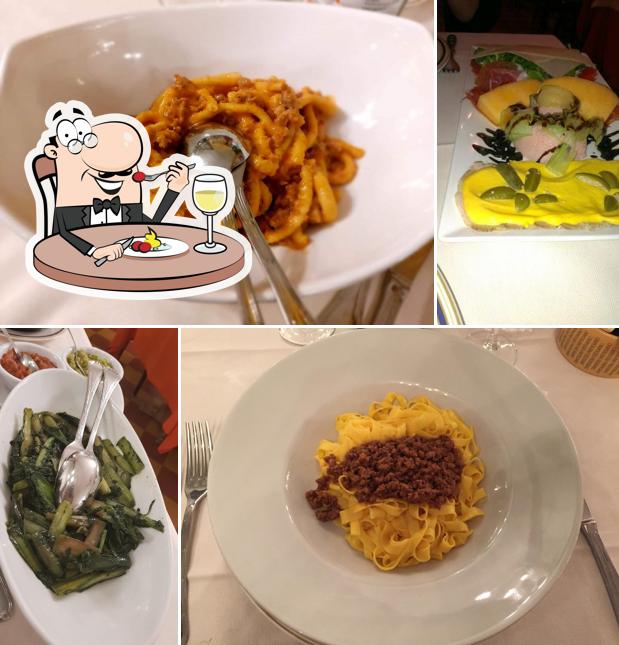
Find the location of `wine glass`. wine glass is located at coordinates (204, 199), (304, 332), (491, 339).